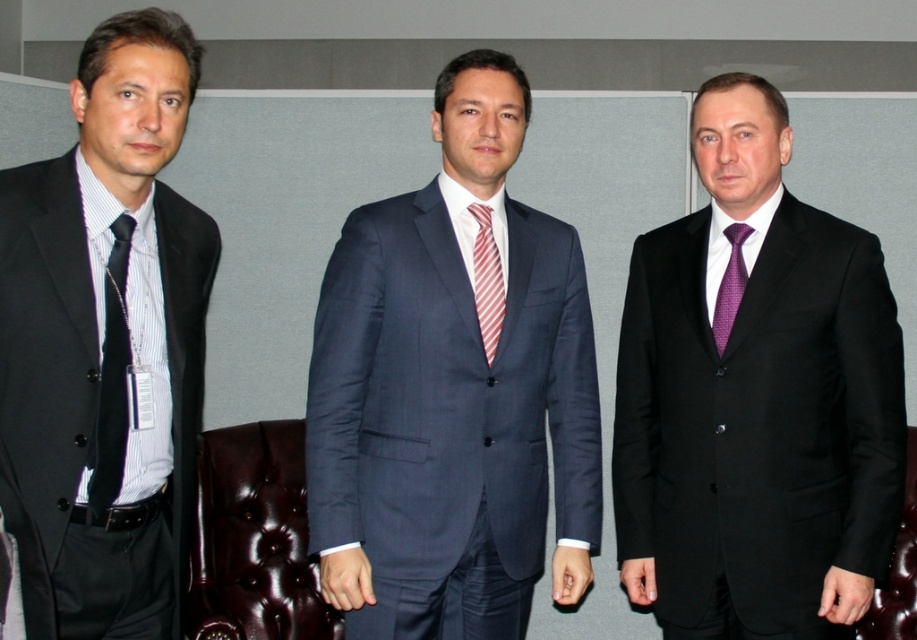
You are a photographer adjusting your camera settings to focus on the black silk tie at left and the purple textured tie at center. Which tie should you focus on first to ensure both are in sharp focus?

You should focus on the black silk tie at left first since it is closer to the viewer than the purple textured tie at center, ensuring both ties will be in focus when starting with the closer one.

Based on the scene description, which object is taller between the matte black suit at left and the brown leather armchair at center?

The matte black suit at left is taller than the brown leather armchair at center according to the description.

You are a photographer setting up for a group photo. You notice the black silk tie at left and the purple textured tie at center. Which tie is wider?

The purple textured tie at center is wider than the black silk tie at left.